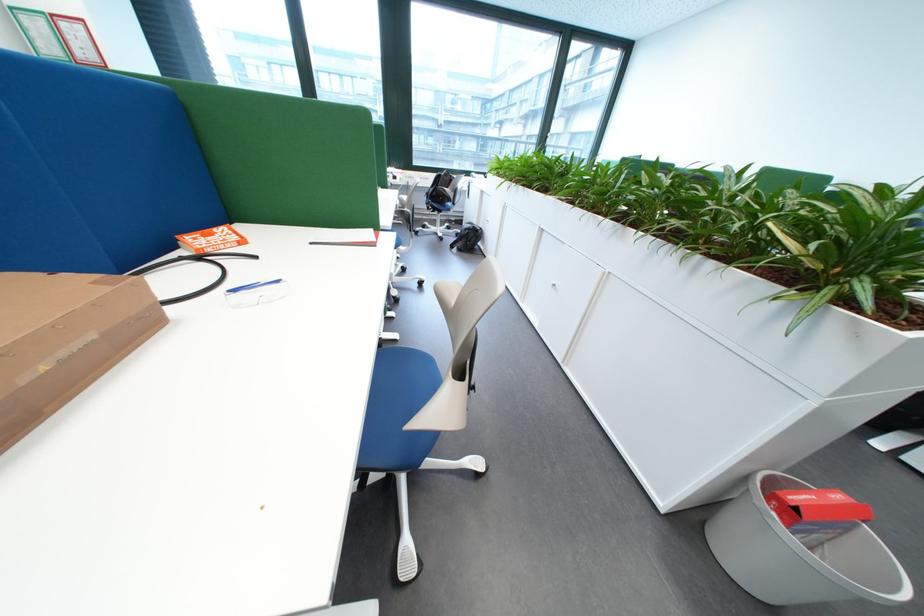
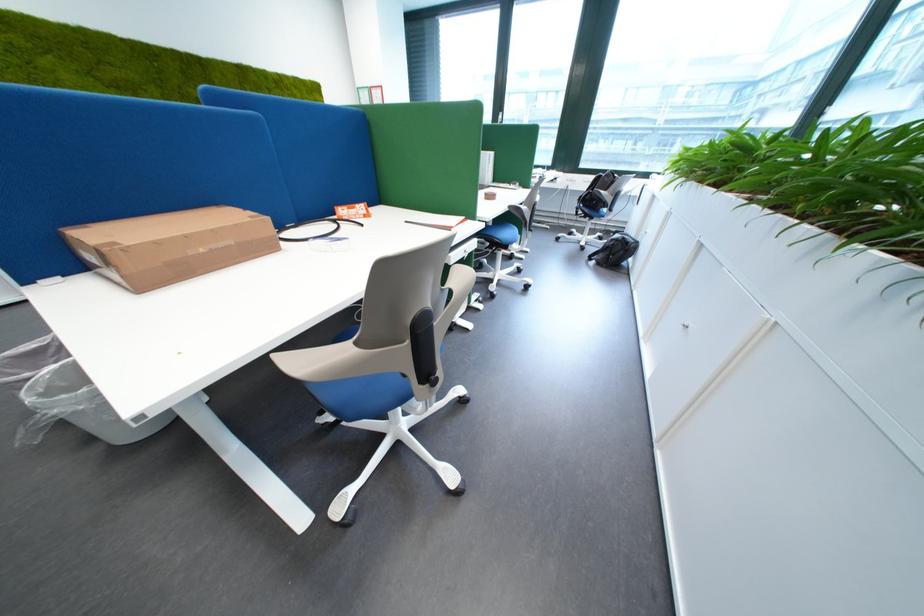
Question: How did the camera likely rotate?

Choices:
 (A) Left
 (B) Right
 (C) Up
 (D) Down

Answer: (A)